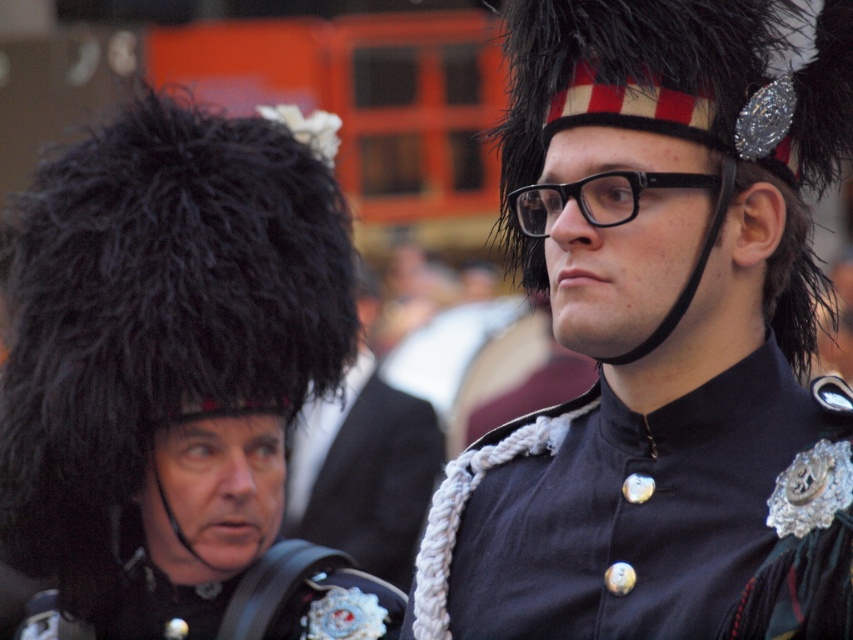
Question: Considering the real-world distances, which object is closest to the metallic silver badge at lower left?

Choices:
 (A) black fabric uniform at center
 (B) black fuzzy hat at left

Answer: (B)

Question: Considering the real-world distances, which object is closest to the shiny black hat at center?

Choices:
 (A) white corduroy sash at center
 (B) black fuzzy hat at left
 (C) black fabric uniform at center
 (D) metallic silver badge at lower left

Answer: (C)

Question: Observing the image, what is the correct spatial positioning of shiny black hat at center in reference to black fabric uniform at center?

Choices:
 (A) above
 (B) below

Answer: (A)

Question: Can you confirm if shiny black hat at center is positioned to the left of black fabric uniform at center?

Choices:
 (A) yes
 (B) no

Answer: (B)

Question: Does black fuzzy hat at left appear on the left side of white corduroy sash at center?

Choices:
 (A) yes
 (B) no

Answer: (A)

Question: Estimate the real-world distances between objects in this image. Which object is closer to the metallic silver badge at lower left?

Choices:
 (A) black fabric uniform at center
 (B) shiny black hat at center

Answer: (A)